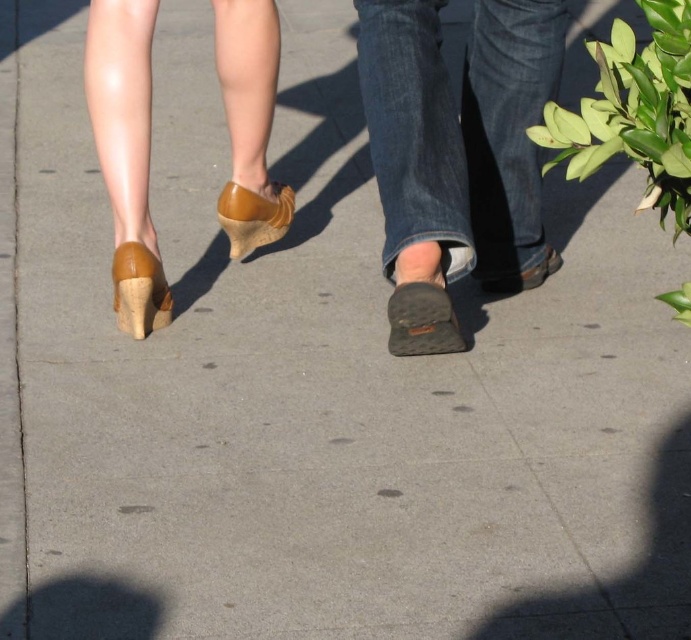
You are a shoe designer observing two pairs of footwear in the image. Which one has a larger size between the dark brown suede shoe at center and the matte brown sandal at center?

The dark brown suede shoe at center has a larger size compared to the matte brown sandal at center.

You are a shoe designer observing two pairs of feet walking on a sidewalk. You notice the leather shoe at center and the matte brown wedge at lower left. Which one has a smaller size?

The leather shoe at center has a smaller size compared to the matte brown wedge at lower left.